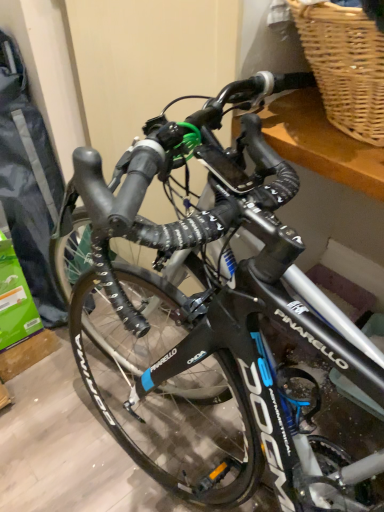
Question: Should I look upward or downward to see woven wicker picnic basket at upper right?

Choices:
 (A) up
 (B) down

Answer: (A)